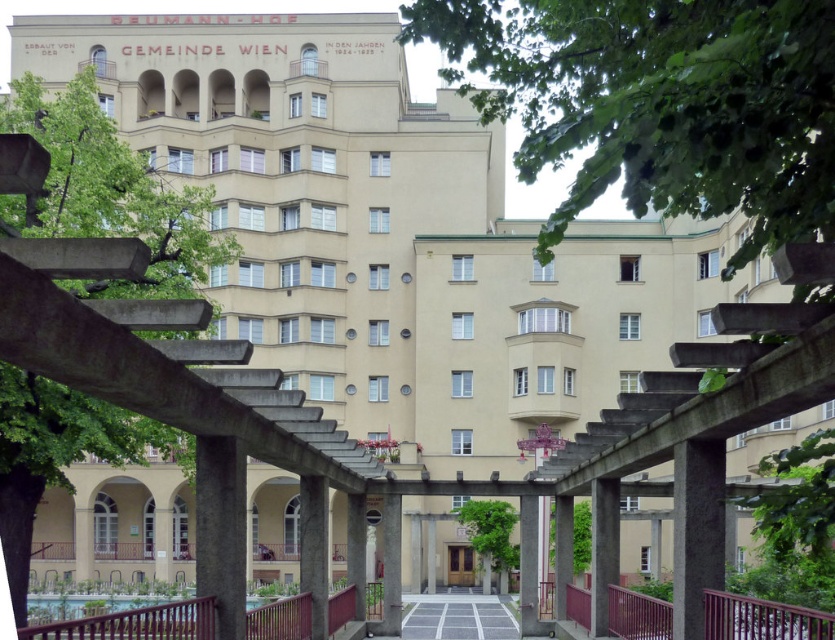
Which is in front, point (350, 600) or point (446, 604)?

Point (350, 600) is more forward.

Consider the image. Does red painted metal railing at lower center have a greater width compared to gray concrete path at center?

Incorrect, red painted metal railing at lower center's width does not surpass gray concrete path at center's.

You are a GUI agent. You are given a task and a screenshot of the screen. Output one action in this format:
    pyautogui.click(x=<x>, y=<y>)
    Task: Click on the red painted metal railing at lower center
    Image resolution: width=835 pixels, height=640 pixels.
    Given the screenshot: What is the action you would take?
    pyautogui.click(x=135, y=624)

Between point (780, 608) and point (477, 628), which one is positioned in front?

Point (780, 608)

Which is behind, point (623, 621) or point (479, 620)?

The point (479, 620) is more distant.

You are a GUI agent. You are given a task and a screenshot of the screen. Output one action in this format:
    pyautogui.click(x=<x>, y=<y>)
    Task: Click on the metallic burgundy railing at lower center
    
    Given the screenshot: What is the action you would take?
    pyautogui.click(x=762, y=618)

Locate an element on the screen. The image size is (835, 640). metallic burgundy railing at lower center is located at coordinates (762, 618).

Does red painted metal railing at lower center appear on the left side of metallic burgundy railing at lower center?

Yes, red painted metal railing at lower center is to the left of metallic burgundy railing at lower center.

Can you confirm if red painted metal railing at lower center is smaller than metallic burgundy railing at lower center?

Actually, red painted metal railing at lower center might be larger than metallic burgundy railing at lower center.

Measure the distance between point (178, 637) and camera.

Point (178, 637) is 23.13 meters away from camera.

At what (x,y) coordinates should I click in order to perform the action: click on red painted metal railing at lower center. Please return your answer as a coordinate pair (x, y). This screenshot has height=640, width=835. Looking at the image, I should click on (135, 624).